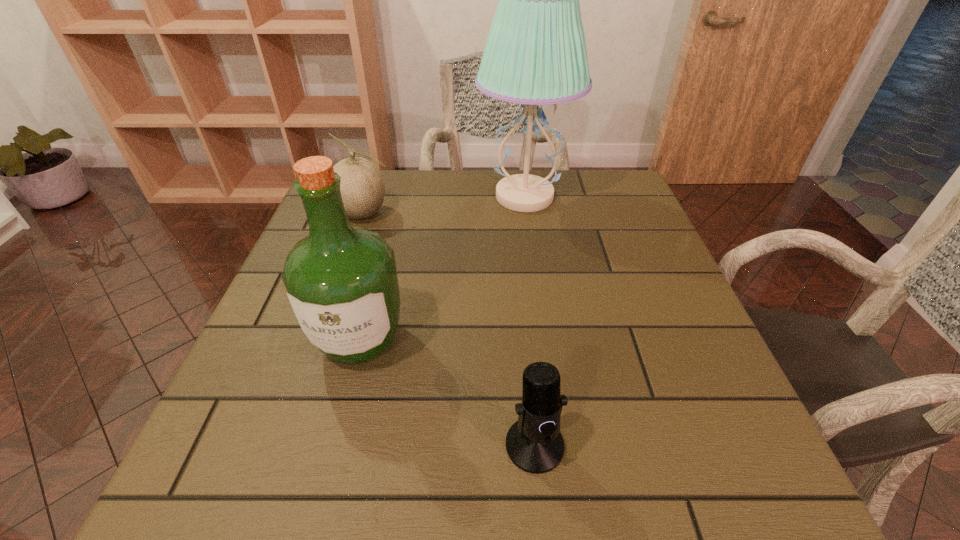
Identify which object is the second closest to the cantaloup. Please provide its 2D coordinates. Your answer should be formatted as a tuple, i.e. [(x, y)], where the tuple contains the x and y coordinates of a point satisfying the conditions above.

[(341, 280)]

Where is `the second closest object to the microphone`? the second closest object to the microphone is located at coordinates (535, 54).